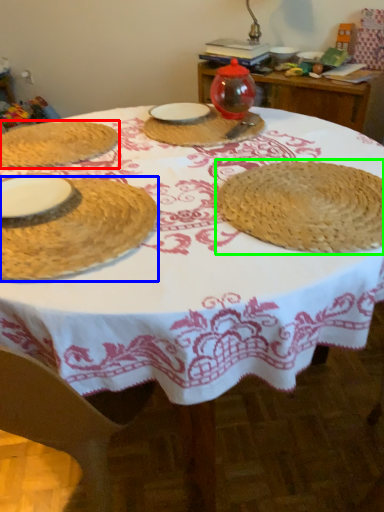
Question: Which is nearer to the table (highlighted by a red box)? tableware (highlighted by a blue box) or straw hat (highlighted by a green box).

Choices:
 (A) tableware
 (B) straw hat

Answer: (A)